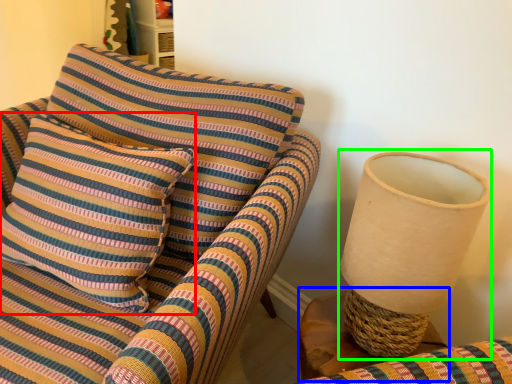
Question: Which is nearer to the pillow (highlighted by a red box)? table (highlighted by a blue box) or table lamp (highlighted by a green box).

Choices:
 (A) table
 (B) table lamp

Answer: (A)